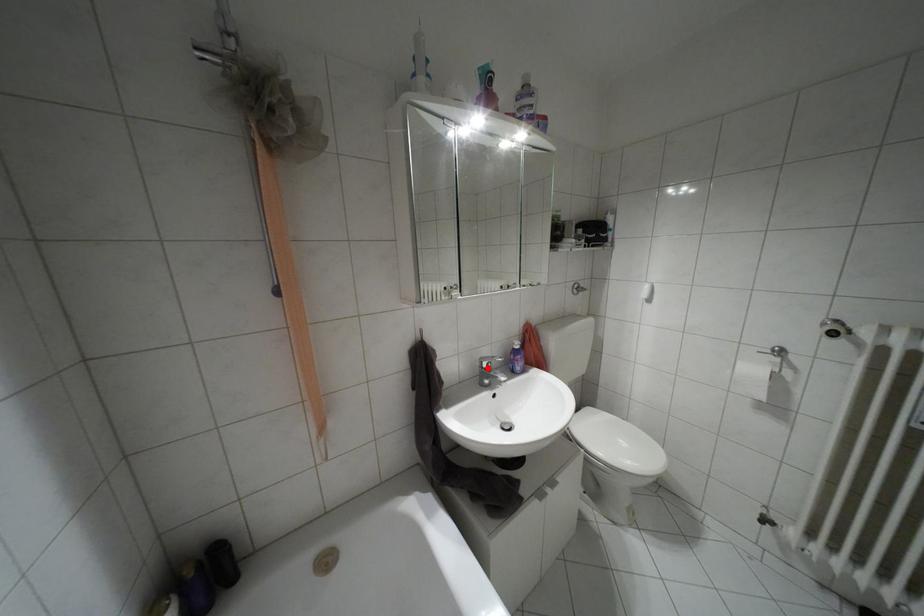
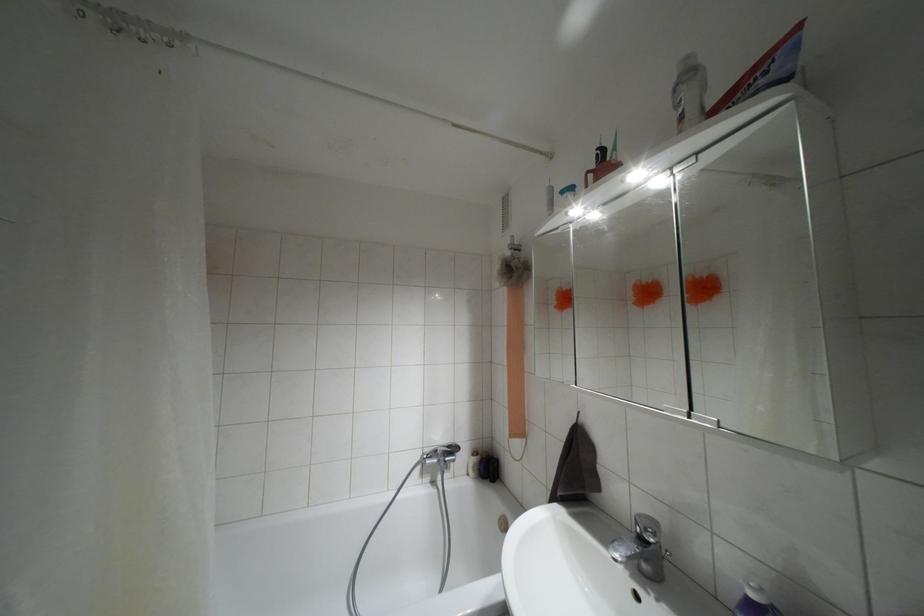
In the second image, find the point that corresponds to the highlighted location in the first image.

(641, 538)